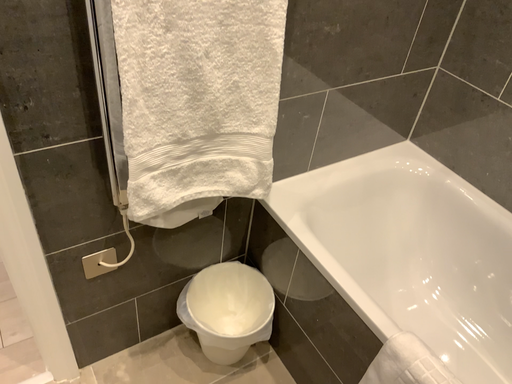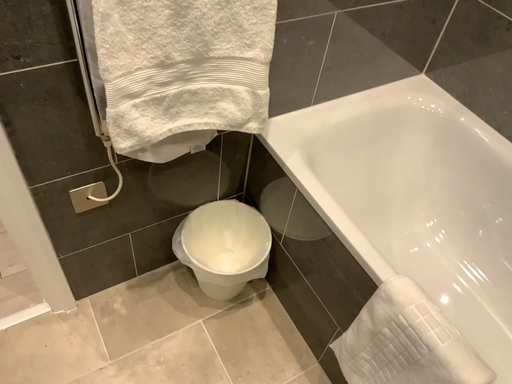
Question: Which way did the camera rotate in the video?

Choices:
 (A) rotated downward
 (B) rotated upward

Answer: (A)